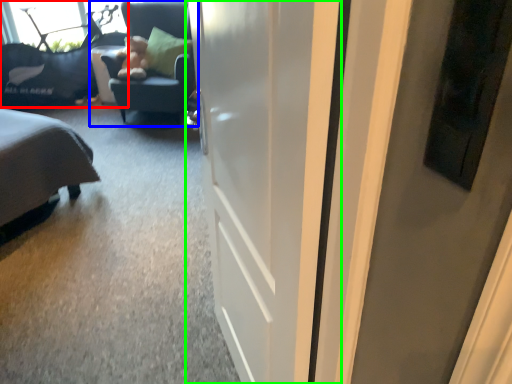
Question: Based on their relative distances, which object is nearer to furniture (highlighted by a red box)? Choose from chair (highlighted by a blue box) and door (highlighted by a green box).

Choices:
 (A) chair
 (B) door

Answer: (A)